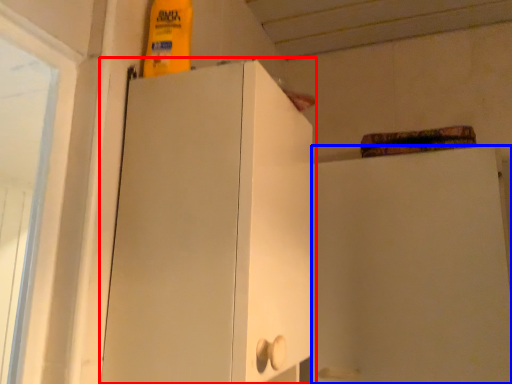
Question: Which of the following is the farthest to the observer, cupboard (highlighted by a red box) or cabinetry (highlighted by a blue box)?

Choices:
 (A) cupboard
 (B) cabinetry

Answer: (B)